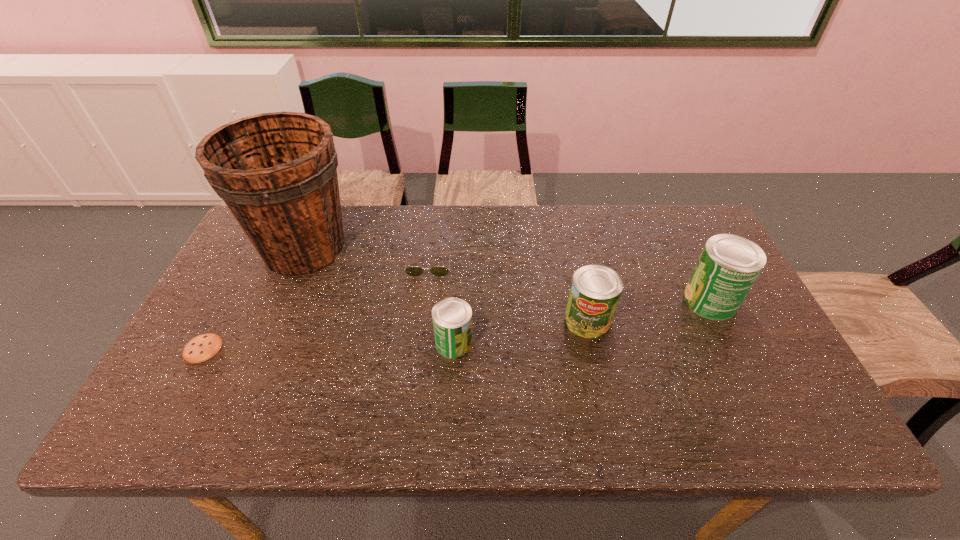
You are a GUI agent. You are given a task and a screenshot of the screen. Output one action in this format:
    pyautogui.click(x=<x>, y=<y>)
    Task: Click on the object that is at the far left corner
    Image resolution: width=960 pixels, height=540 pixels.
    Given the screenshot: What is the action you would take?
    pyautogui.click(x=277, y=172)

I want to click on vacant space at the far edge of the desktop, so click(x=417, y=210).

In the image, there is a desktop. Identify the location of vacant space at the near edge. The width and height of the screenshot is (960, 540). (292, 377).

This screenshot has width=960, height=540. In order to click on free space at the left edge in this screenshot , I will do `click(237, 352)`.

Find the location of a particular element. free space at the right edge of the desktop is located at coordinates (734, 319).

This screenshot has height=540, width=960. I want to click on free region at the near left corner, so click(209, 370).

The width and height of the screenshot is (960, 540). I want to click on vacant space at the far right corner of the desktop, so click(683, 206).

In the image, there is a desktop. Where is `vacant space at the near right corner`? The width and height of the screenshot is (960, 540). vacant space at the near right corner is located at coordinates (783, 386).

The height and width of the screenshot is (540, 960). Find the location of `free space between the bucket and the shortest can`. free space between the bucket and the shortest can is located at coordinates (379, 296).

Identify the location of empty space that is in between the bucket and the rightmost object. (508, 274).